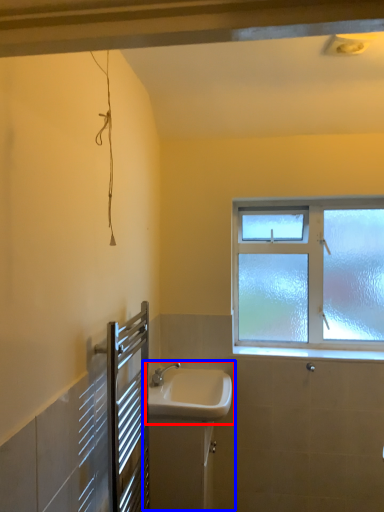
Question: Which object appears farthest to the camera in this image, sink (highlighted by a red box) or sink (highlighted by a blue box)?

Choices:
 (A) sink
 (B) sink

Answer: (B)